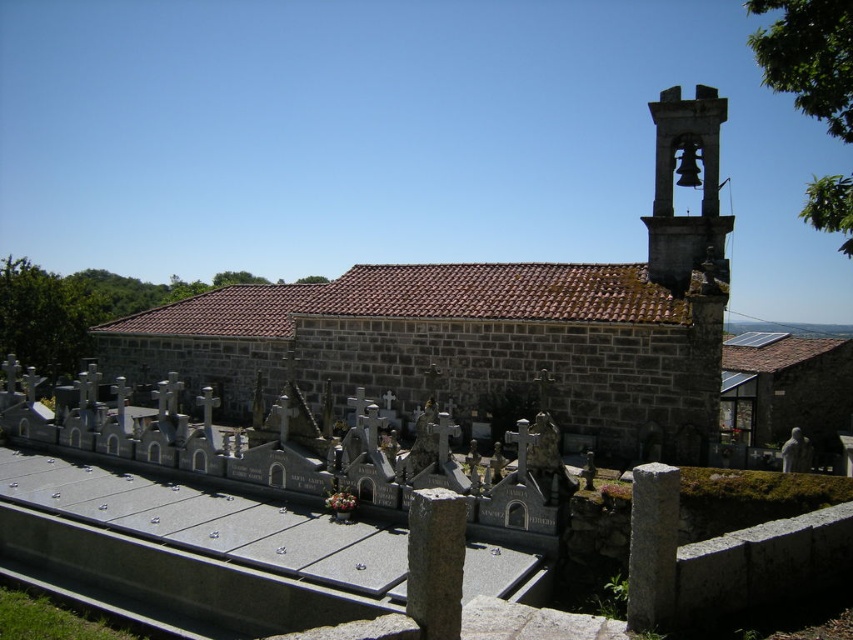
You are standing at the entrance of the cemetery and want to take a photo of the brown stone church at center and the matte gray stone bell tower at upper right. Which object should you focus on first if you want to capture both in a single frame without moving the camera?

The brown stone church at center is much taller than the matte gray stone stone bell tower at upper right, so you should focus on the brown stone church at center first to ensure it fits within the frame.

You are standing in the cemetery and want to take a photo of the brown stone church at center and the matte gray stone bell tower at upper right. Which object should you point your camera at first if you want to capture both in one frame without moving the camera?

You should point your camera at the brown stone church at center first because it is below the matte gray stone bell tower at upper right, so by centering the church, the bell tower will naturally be in the upper part of the frame.

You are standing in the cemetery and want to take a photo of the brown stone church at center and the matte gray stone bell tower at upper right. Which object will appear closer to the camera in the photo?

The brown stone church at center will appear closer to the camera in the photo because it is in front of the matte gray stone bell tower at upper right.